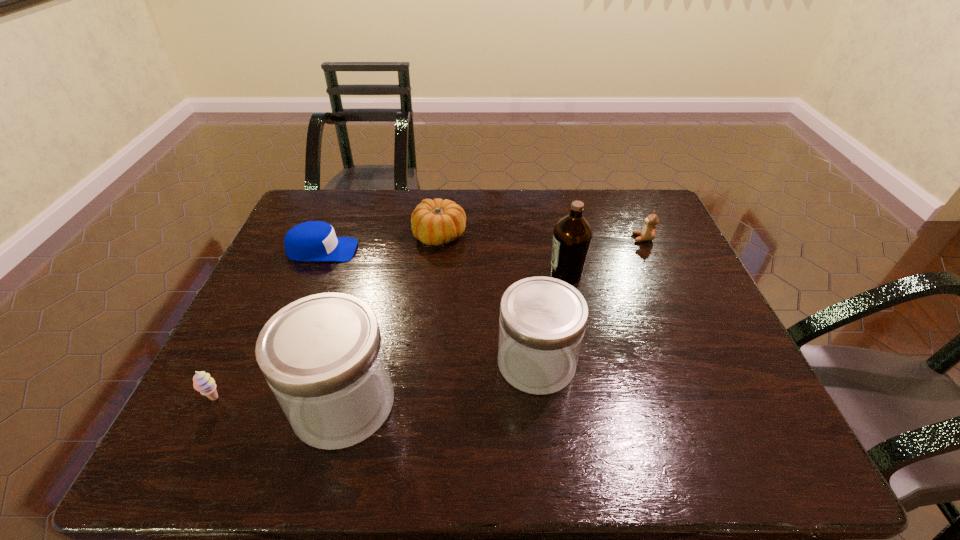
The width and height of the screenshot is (960, 540). What are the coordinates of `teddy bear that is positioned at the far edge` in the screenshot? It's located at (648, 232).

Where is `sherbert present at the near edge`? The width and height of the screenshot is (960, 540). sherbert present at the near edge is located at coordinates (202, 382).

This screenshot has height=540, width=960. Identify the location of baseball cap that is at the left edge. click(x=314, y=240).

Locate an element on the screen. This screenshot has width=960, height=540. sherbert that is at the left edge is located at coordinates (202, 382).

Image resolution: width=960 pixels, height=540 pixels. Identify the location of object situated at the right edge. (648, 232).

At what (x,y) coordinates should I click in order to perform the action: click on object located at the near left corner. Please return your answer as a coordinate pair (x, y). Looking at the image, I should click on (202, 382).

Where is `object present at the far right corner`? Image resolution: width=960 pixels, height=540 pixels. object present at the far right corner is located at coordinates (648, 232).

Identify the location of free space at the far edge. (518, 207).

Locate an element on the screen. The height and width of the screenshot is (540, 960). vacant space at the near edge of the desktop is located at coordinates (537, 410).

The height and width of the screenshot is (540, 960). Identify the location of free point at the left edge. (284, 248).